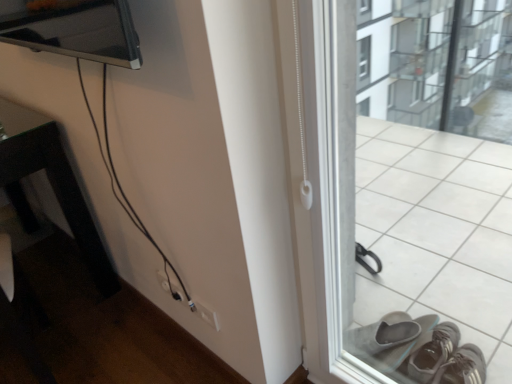
What are the coordinates of `white plastic window frame at right` in the screenshot? It's located at (423, 188).

This screenshot has height=384, width=512. Find the location of `black glossy table at left`. black glossy table at left is located at coordinates (53, 181).

Locate an element on the screen. This screenshot has height=384, width=512. white plastic window frame at right is located at coordinates (423, 188).

Is white plastic electric outlet at lower center a part of white plastic window frame at right?

No, white plastic electric outlet at lower center is not inside white plastic window frame at right.

Could you measure the distance between white plastic window frame at right and white plastic electric outlet at lower center?

3.49 feet.

From a real-world perspective, is white plastic window frame at right located higher than white plastic electric outlet at lower center?

Yes, from a real-world perspective, white plastic window frame at right is above white plastic electric outlet at lower center.

Between white plastic window frame at right and white plastic electric outlet at lower center, which one is positioned behind?

white plastic electric outlet at lower center is more distant.

Which object is wider, white plastic electric outlet at lower center or white plastic window frame at right?

Wider between the two is white plastic window frame at right.

Does white plastic electric outlet at lower center appear on the left side of white plastic window frame at right?

Correct, you'll find white plastic electric outlet at lower center to the left of white plastic window frame at right.

From a real-world perspective, is white plastic electric outlet at lower center positioned above or below white plastic window frame at right?

Clearly, from a real-world perspective, white plastic electric outlet at lower center is below white plastic window frame at right.

From the image's perspective, is white plastic electric outlet at lower center under white plastic window frame at right?

Indeed, from the image's perspective, white plastic electric outlet at lower center is shown beneath white plastic window frame at right.

Is point (211, 320) less distant than point (90, 264)?

Yes.

From the image's perspective, which is below, white plastic electric outlet at lower center or black glossy table at left?

white plastic electric outlet at lower center appears lower in the image.

Is white plastic electric outlet at lower center bigger than black glossy table at left?

No, white plastic electric outlet at lower center is not bigger than black glossy table at left.

Can you confirm if white plastic electric outlet at lower center is wider than black glossy table at left?

In fact, white plastic electric outlet at lower center might be narrower than black glossy table at left.

Considering the relative sizes of black glossy table at left and white plastic window frame at right in the image provided, is black glossy table at left bigger than white plastic window frame at right?

Indeed, black glossy table at left has a larger size compared to white plastic window frame at right.

Can you tell me how much black glossy table at left and white plastic window frame at right differ in facing direction?

The facing directions of black glossy table at left and white plastic window frame at right are 1.36 degrees apart.

Is black glossy table at left wider than white plastic window frame at right?

Indeed, black glossy table at left has a greater width compared to white plastic window frame at right.

The image size is (512, 384). What are the coordinates of `table that is on the left side of white plastic window frame at right` in the screenshot? It's located at tap(53, 181).

Considering the sizes of objects black glossy table at left and white plastic electric outlet at lower center in the image provided, who is bigger, black glossy table at left or white plastic electric outlet at lower center?

black glossy table at left is bigger.

From a real-world perspective, which is physically above, black glossy table at left or white plastic electric outlet at lower center?

black glossy table at left is physically above.

Considering the relative positions of black glossy table at left and white plastic electric outlet at lower center in the image provided, is black glossy table at left behind white plastic electric outlet at lower center?

No, black glossy table at left is closer to the viewer.

Measure the distance from black glossy table at left to white plastic electric outlet at lower center.

black glossy table at left is 21.70 inches away from white plastic electric outlet at lower center.

From a real-world perspective, which is physically above, white plastic window frame at right or black glossy table at left?

In real-world perspective, white plastic window frame at right is above.

Considering the relative sizes of white plastic window frame at right and black glossy table at left in the image provided, is white plastic window frame at right smaller than black glossy table at left?

Yes, white plastic window frame at right is smaller than black glossy table at left.

How many degrees apart are the facing directions of white plastic window frame at right and black glossy table at left?

The angle between the facing direction of white plastic window frame at right and the facing direction of black glossy table at left is 1.36 degrees.

Find the location of a particular element. The height and width of the screenshot is (384, 512). window frame above the white plastic electric outlet at lower center (from a real-world perspective) is located at coordinates (423, 188).

Identify the location of window frame that is in front of the white plastic electric outlet at lower center. tap(423, 188).

Considering their positions, is white plastic electric outlet at lower center positioned further to white plastic window frame at right than black glossy table at left?

Among the two, black glossy table at left is located further to white plastic window frame at right.

Looking at the image, which one is located further to black glossy table at left, white plastic electric outlet at lower center or white plastic window frame at right?

Among the two, white plastic window frame at right is located further to black glossy table at left.

Based on their spatial positions, is black glossy table at left or white plastic electric outlet at lower center closer to white plastic window frame at right?

white plastic electric outlet at lower center lies closer to white plastic window frame at right than the other object.

Based on their spatial positions, is white plastic window frame at right or black glossy table at left closer to white plastic electric outlet at lower center?

The object closer to white plastic electric outlet at lower center is black glossy table at left.

Looking at the image, which one is located further to black glossy table at left, white plastic window frame at right or white plastic electric outlet at lower center?

white plastic window frame at right.

Which object lies nearer to the anchor point white plastic electric outlet at lower center, black glossy table at left or white plastic window frame at right?

The object closer to white plastic electric outlet at lower center is black glossy table at left.

Find the location of a particular element. The width and height of the screenshot is (512, 384). electric outlet located between black glossy table at left and white plastic window frame at right in the left-right direction is located at coordinates (207, 315).